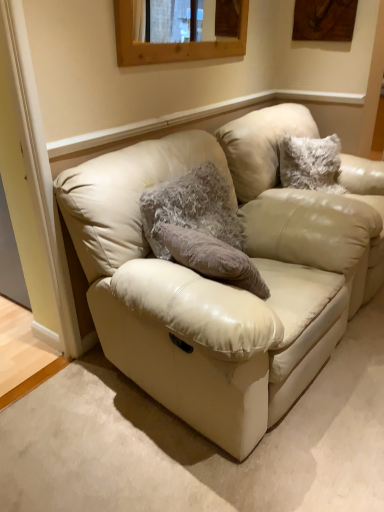
Describe the element at coordinates (224, 285) in the screenshot. I see `beige leather couch at center` at that location.

Locate an element on the screen. beige leather couch at center is located at coordinates (224, 285).

Measure the distance between point (207,57) and camera.

The depth of point (207,57) is 2.31 meters.

Locate an element on the screen. The width and height of the screenshot is (384, 512). beige leather swivel chair at center is located at coordinates (261, 145).

You are a GUI agent. You are given a task and a screenshot of the screen. Output one action in this format:
    pyautogui.click(x=<x>, y=<y>)
    Task: Click on the beige leather couch at center
    This screenshot has width=384, height=512.
    Given the screenshot: What is the action you would take?
    pyautogui.click(x=224, y=285)

From a real-world perspective, which is physically above, beige leather swivel chair at center or beige leather couch at center?

In real-world perspective, beige leather couch at center is above.

Is beige leather swivel chair at center positioned with its back to beige leather couch at center?

That's not correct — beige leather swivel chair at center is not looking away from beige leather couch at center.

Can beige leather couch at center be found inside beige leather swivel chair at center?

No, beige leather couch at center is not inside beige leather swivel chair at center.

From a real-world perspective, is beige leather couch at center above or below fuzzy gray pillow at center?

From a real-world perspective, beige leather couch at center is physically below fuzzy gray pillow at center.

Between beige leather couch at center and fuzzy gray pillow at center, which one has more height?

With more height is beige leather couch at center.

Which object is thinner, beige leather couch at center or fuzzy gray pillow at center?

fuzzy gray pillow at center is thinner.

Is beige leather swivel chair at center at the back of fuzzy gray pillow at center?

No, beige leather swivel chair at center is not at the back of fuzzy gray pillow at center.

Considering the positions of points (204, 202) and (375, 287), is point (204, 202) closer to camera compared to point (375, 287)?

Yes, point (204, 202) is closer to viewer.

Is fuzzy gray pillow at center located outside beige leather swivel chair at center?

That's correct, fuzzy gray pillow at center is outside of beige leather swivel chair at center.

Which of these two, fuzzy gray pillow at center or beige leather swivel chair at center, stands shorter?

fuzzy gray pillow at center.

From the picture: Who is bigger, wooden frame at upper center or beige leather swivel chair at center?

Bigger between the two is beige leather swivel chair at center.

Measure the distance between wooden frame at upper center and beige leather swivel chair at center.

wooden frame at upper center is 21.05 inches from beige leather swivel chair at center.

Considering the relative sizes of wooden frame at upper center and beige leather swivel chair at center in the image provided, is wooden frame at upper center wider than beige leather swivel chair at center?

In fact, wooden frame at upper center might be narrower than beige leather swivel chair at center.

What's the angular difference between wooden frame at upper center and beige leather swivel chair at center's facing directions?

wooden frame at upper center and beige leather swivel chair at center are facing 0.00752 degrees away from each other.

Is beige leather swivel chair at center looking in the opposite direction of wooden frame at upper center?

beige leather swivel chair at center does not have its back to wooden frame at upper center.

What's the angular difference between beige leather swivel chair at center and wooden frame at upper center's facing directions?

0.00752 degrees.

Consider the image. From the image's perspective, which is below, beige leather swivel chair at center or wooden frame at upper center?

beige leather swivel chair at center is shown below in the image.

Locate an element on the screen. The width and height of the screenshot is (384, 512). window that appears above the beige leather swivel chair at center (from the image's perspective) is located at coordinates (171, 42).

Is beige leather couch at center not close to beige leather swivel chair at center?

beige leather couch at center is near beige leather swivel chair at center, not far away.

The height and width of the screenshot is (512, 384). I want to click on swivel chair above the beige leather couch at center (from the image's perspective), so click(261, 145).

In the scene shown: From the image's perspective, is beige leather couch at center located above or below beige leather swivel chair at center?

Based on their image positions, beige leather couch at center is located beneath beige leather swivel chair at center.

In terms of height, does beige leather couch at center look taller or shorter compared to beige leather swivel chair at center?

In the image, beige leather couch at center appears to be shorter than beige leather swivel chair at center.

Could beige leather couch at center be considered to be inside fuzzy gray pillow at center?

No, beige leather couch at center is not inside fuzzy gray pillow at center.

From a real-world perspective, who is located lower, fuzzy gray pillow at center or beige leather couch at center?

From a 3D spatial view, beige leather couch at center is below.

Is point (193, 176) less distant than point (299, 346)?

No, it is not.

Does fuzzy gray pillow at center come in front of beige leather couch at center?

No, fuzzy gray pillow at center is further to the viewer.

This screenshot has height=512, width=384. I want to click on swivel chair lying on the right of beige leather couch at center, so click(261, 145).

There is a beige leather couch at center. Where is `animal above it (from a real-world perspective)`? The width and height of the screenshot is (384, 512). animal above it (from a real-world perspective) is located at coordinates (191, 208).

Estimate the real-world distances between objects in this image. Which object is further from beige leather swivel chair at center, wooden frame at upper center or beige leather couch at center?

beige leather couch at center is further to beige leather swivel chair at center.

Looking at the image, which one is located further to beige leather swivel chair at center, fuzzy gray pillow at center or wooden frame at upper center?

fuzzy gray pillow at center lies further to beige leather swivel chair at center than the other object.

Considering their positions, is fuzzy gray pillow at center positioned further to beige leather couch at center than wooden frame at upper center?

wooden frame at upper center lies further to beige leather couch at center than the other object.

When comparing their distances from beige leather couch at center, does wooden frame at upper center or fuzzy gray pillow at center seem closer?

fuzzy gray pillow at center is positioned closer to the anchor beige leather couch at center.

Which object lies further to the anchor point fuzzy gray pillow at center, beige leather couch at center or wooden frame at upper center?

Among the two, wooden frame at upper center is located further to fuzzy gray pillow at center.

Looking at the image, which one is located closer to fuzzy gray pillow at center, beige leather swivel chair at center or wooden frame at upper center?

beige leather swivel chair at center lies closer to fuzzy gray pillow at center than the other object.

Which object lies nearer to the anchor point fuzzy gray pillow at center, beige leather swivel chair at center or beige leather couch at center?

Based on the image, beige leather couch at center appears to be nearer to fuzzy gray pillow at center.

Estimate the real-world distances between objects in this image. Which object is further from wooden frame at upper center, beige leather swivel chair at center or fuzzy gray pillow at center?

fuzzy gray pillow at center is further to wooden frame at upper center.

Locate an element on the screen. The height and width of the screenshot is (512, 384). animal between wooden frame at upper center and beige leather couch at center from top to bottom is located at coordinates (191, 208).

Locate an element on the screen. This screenshot has width=384, height=512. swivel chair between wooden frame at upper center and fuzzy gray pillow at center in the vertical direction is located at coordinates (261, 145).

Identify the location of swivel chair between wooden frame at upper center and beige leather couch at center in the up-down direction. (261, 145).

What are the coordinates of `studio couch located between fuzzy gray pillow at center and beige leather swivel chair at center in the left-right direction` in the screenshot? It's located at (224, 285).